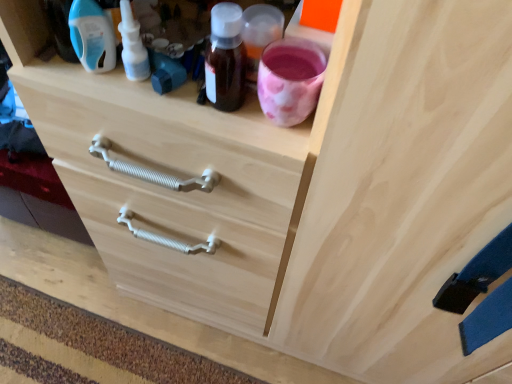
Question: Is white plastic nasal spray at upper left, the 2th bottle viewed from the left, bigger than natural wood drawer at center?

Choices:
 (A) yes
 (B) no

Answer: (B)

Question: From a real-world perspective, is white plastic nasal spray at upper left, the 2th bottle viewed from the left, on natural wood drawer at center?

Choices:
 (A) yes
 (B) no

Answer: (A)

Question: Is white plastic nasal spray at upper left, the 2th bottle viewed from the left, to the right of natural wood drawer at center from the viewer's perspective?

Choices:
 (A) no
 (B) yes

Answer: (B)

Question: From a real-world perspective, is white plastic nasal spray at upper left, the 2th bottle viewed from the left, beneath natural wood drawer at center?

Choices:
 (A) no
 (B) yes

Answer: (A)

Question: Is white plastic nasal spray at upper left, the 2th bottle viewed from the left, in front of natural wood drawer at center?

Choices:
 (A) no
 (B) yes

Answer: (B)

Question: Is white plastic nasal spray at upper left, acting as the first bottle starting from the right, wider than natural wood drawer at center?

Choices:
 (A) yes
 (B) no

Answer: (B)

Question: Is natural wood drawer at center bigger than blue plastic bottle at upper left, which ranks as the 1th bottle in left-to-right order?

Choices:
 (A) no
 (B) yes

Answer: (B)

Question: Is natural wood drawer at center positioned before blue plastic bottle at upper left, the 2th bottle in the right-to-left sequence?

Choices:
 (A) no
 (B) yes

Answer: (A)

Question: Does natural wood drawer at center have a lesser height compared to blue plastic bottle at upper left, the 2th bottle in the right-to-left sequence?

Choices:
 (A) no
 (B) yes

Answer: (B)

Question: Does natural wood drawer at center have a greater width compared to blue plastic bottle at upper left, the 2th bottle in the right-to-left sequence?

Choices:
 (A) no
 (B) yes

Answer: (B)

Question: From the image's perspective, is natural wood drawer at center located above blue plastic bottle at upper left, the 2th bottle in the right-to-left sequence?

Choices:
 (A) no
 (B) yes

Answer: (A)

Question: Is natural wood drawer at center positioned far away from blue plastic bottle at upper left, which ranks as the 1th bottle in left-to-right order?

Choices:
 (A) no
 (B) yes

Answer: (A)

Question: Does blue plastic bottle at upper left, the 2th bottle in the right-to-left sequence, appear on the left side of white plastic nasal spray at upper left, the 2th bottle viewed from the left?

Choices:
 (A) yes
 (B) no

Answer: (A)